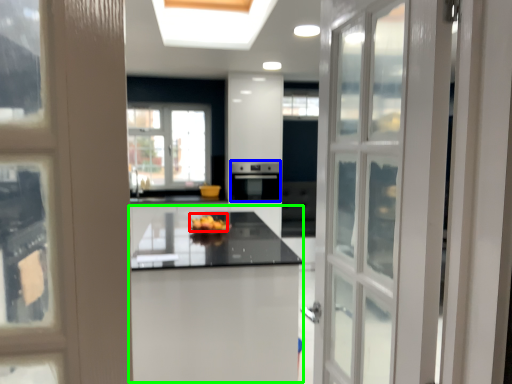
Question: Which object is the farthest from fruit (highlighted by a red box)? Choose among these: appliance (highlighted by a blue box) or table (highlighted by a green box).

Choices:
 (A) appliance
 (B) table

Answer: (A)